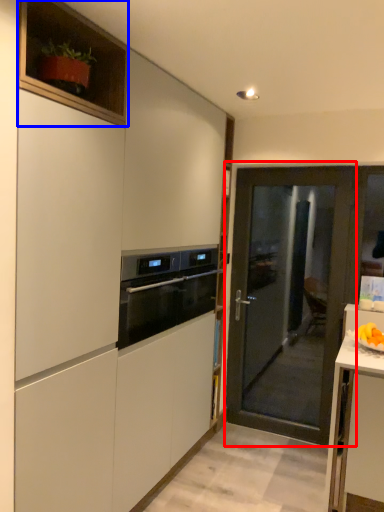
Question: Which of the following is the closest to the observer, door (highlighted by a red box) or cabinetry (highlighted by a blue box)?

Choices:
 (A) door
 (B) cabinetry

Answer: (B)